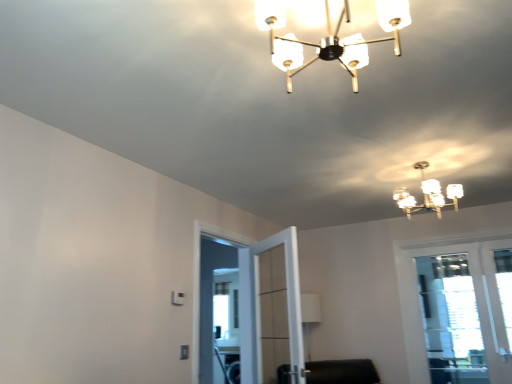
Question: Considering the relative sizes of clear glass door at center and white frosted glass chandelier at upper center, which is the second lamp from left to right, in the image provided, is clear glass door at center taller than white frosted glass chandelier at upper center, which is the second lamp from left to right,?

Choices:
 (A) yes
 (B) no

Answer: (A)

Question: Is clear glass door at center oriented away from white frosted glass chandelier at upper center, which is the second lamp from left to right?

Choices:
 (A) no
 (B) yes

Answer: (A)

Question: Is clear glass door at center shorter than white frosted glass chandelier at upper center, which is the second lamp in top-to-bottom order?

Choices:
 (A) no
 (B) yes

Answer: (A)

Question: Is clear glass door at center bigger than white frosted glass chandelier at upper center, arranged as the 1th lamp when viewed from the right?

Choices:
 (A) yes
 (B) no

Answer: (A)

Question: From a real-world perspective, is clear glass door at center located beneath white frosted glass chandelier at upper center, the second lamp in the front-to-back sequence?

Choices:
 (A) no
 (B) yes

Answer: (B)

Question: Is clear glass door at center closer to the viewer compared to white frosted glass chandelier at upper center, arranged as the 1th lamp when viewed from the right?

Choices:
 (A) no
 (B) yes

Answer: (A)

Question: Does translucent glass chandelier at upper center, the second lamp when ordered from bottom to top, appear on the left side of clear glass door at right?

Choices:
 (A) yes
 (B) no

Answer: (A)

Question: Is translucent glass chandelier at upper center, the second lamp when ordered from bottom to top, at the right side of clear glass door at right?

Choices:
 (A) yes
 (B) no

Answer: (B)

Question: Is translucent glass chandelier at upper center, arranged as the first lamp when viewed from the left, smaller than clear glass door at right?

Choices:
 (A) no
 (B) yes

Answer: (B)

Question: Can clear glass door at right be found inside translucent glass chandelier at upper center, arranged as the first lamp when viewed from the left?

Choices:
 (A) no
 (B) yes

Answer: (A)

Question: Is translucent glass chandelier at upper center, arranged as the first lamp when viewed from the left, facing towards clear glass door at right?

Choices:
 (A) no
 (B) yes

Answer: (A)

Question: Is translucent glass chandelier at upper center, the second lamp when ordered from bottom to top, closer to camera compared to clear glass door at right?

Choices:
 (A) no
 (B) yes

Answer: (B)

Question: Can you confirm if white frosted glass chandelier at upper center, which ranks as the 1th lamp in back-to-front order, is thinner than clear glass door at right?

Choices:
 (A) no
 (B) yes

Answer: (A)